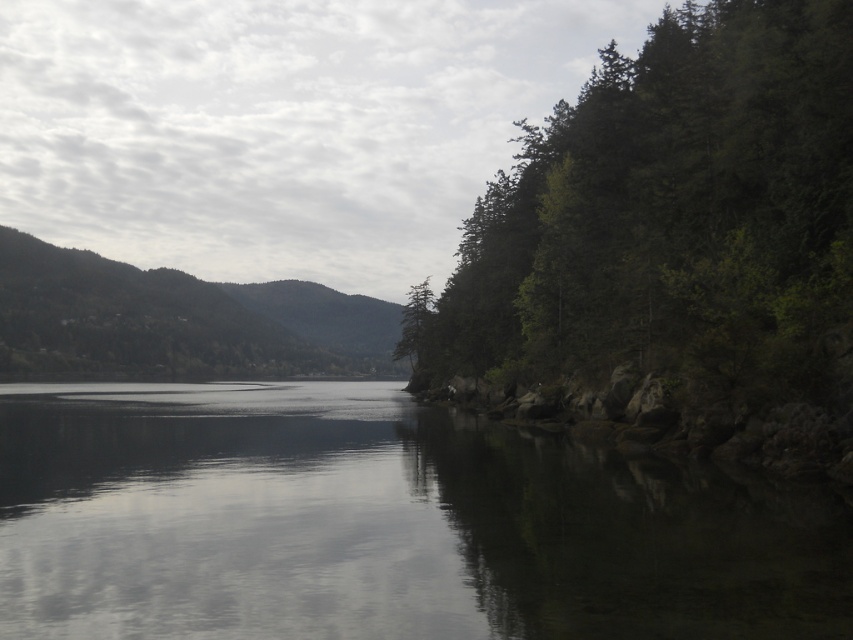
Which of these two, smooth dark water at center or green matte tree at right, stands shorter?

Standing shorter between the two is smooth dark water at center.

Between point (18, 486) and point (581, 97), which one is positioned behind?

The point (581, 97) is behind.

Is point (314, 435) positioned in front of point (523, 136)?

Yes, point (314, 435) is in front of point (523, 136).

You are a GUI agent. You are given a task and a screenshot of the screen. Output one action in this format:
    pyautogui.click(x=<x>, y=<y>)
    Task: Click on the smooth dark water at center
    This screenshot has width=853, height=640.
    Given the screenshot: What is the action you would take?
    pyautogui.click(x=383, y=524)

Which is behind, point (136, 595) or point (431, 291)?

Point (431, 291)

The width and height of the screenshot is (853, 640). What do you see at coordinates (383, 524) in the screenshot? I see `smooth dark water at center` at bounding box center [383, 524].

The image size is (853, 640). I want to click on smooth dark water at center, so click(383, 524).

Is smooth dark water at center shorter than green forested mountain at left?

Indeed, smooth dark water at center has a lesser height compared to green forested mountain at left.

Who is shorter, smooth dark water at center or green forested mountain at left?

With less height is smooth dark water at center.

Who is more forward, (367, 577) or (3, 346)?

Point (367, 577) is more forward.

I want to click on smooth dark water at center, so [383, 524].